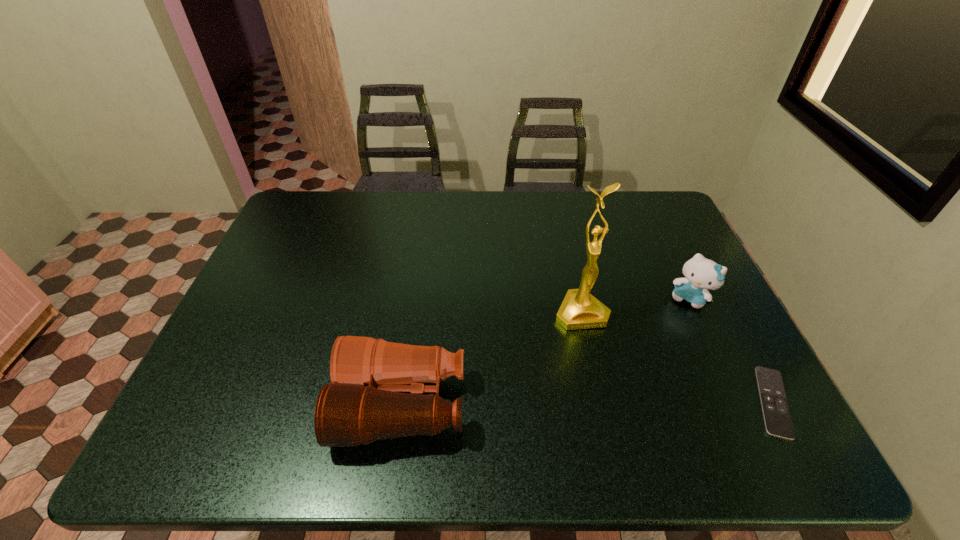
I want to click on vacant space that is in between the shortest object and the leftmost object, so click(x=588, y=403).

The height and width of the screenshot is (540, 960). Find the location of `vacant region between the shortest object and the binoculars`. vacant region between the shortest object and the binoculars is located at coordinates (588, 403).

I want to click on vacant area between the kitten and the award, so click(x=636, y=305).

Identify the location of vacant area that lies between the award and the kitten. The height and width of the screenshot is (540, 960). (636, 305).

Where is `free space that is in between the kitten and the third object from right to left`? free space that is in between the kitten and the third object from right to left is located at coordinates (636, 305).

What are the coordinates of `free space between the leftmost object and the tallest object` in the screenshot? It's located at (x=492, y=358).

You are a GUI agent. You are given a task and a screenshot of the screen. Output one action in this format:
    pyautogui.click(x=<x>, y=<y>)
    Task: Click on the object that can be found as the third closest to the kitten
    Image resolution: width=960 pixels, height=540 pixels.
    Given the screenshot: What is the action you would take?
    pyautogui.click(x=364, y=403)

The height and width of the screenshot is (540, 960). What are the coordinates of `object that is the third closest to the leftmost object` in the screenshot? It's located at (777, 419).

The height and width of the screenshot is (540, 960). Find the location of `free location that satisfies the following two spatial constraints: 1. on the back side of the award; 2. on the left side of the kitten`. free location that satisfies the following two spatial constraints: 1. on the back side of the award; 2. on the left side of the kitten is located at coordinates (578, 299).